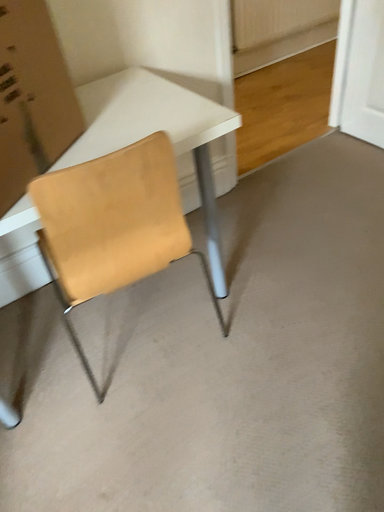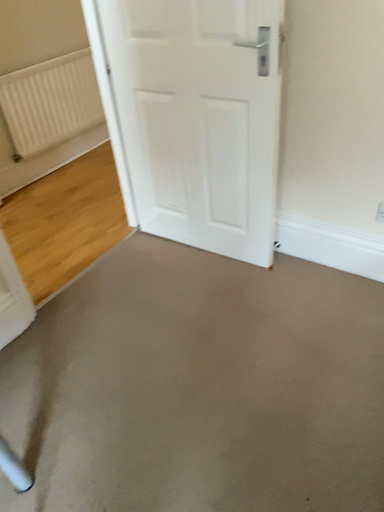
Question: Which way did the camera rotate in the video?

Choices:
 (A) rotated left
 (B) rotated right

Answer: (B)